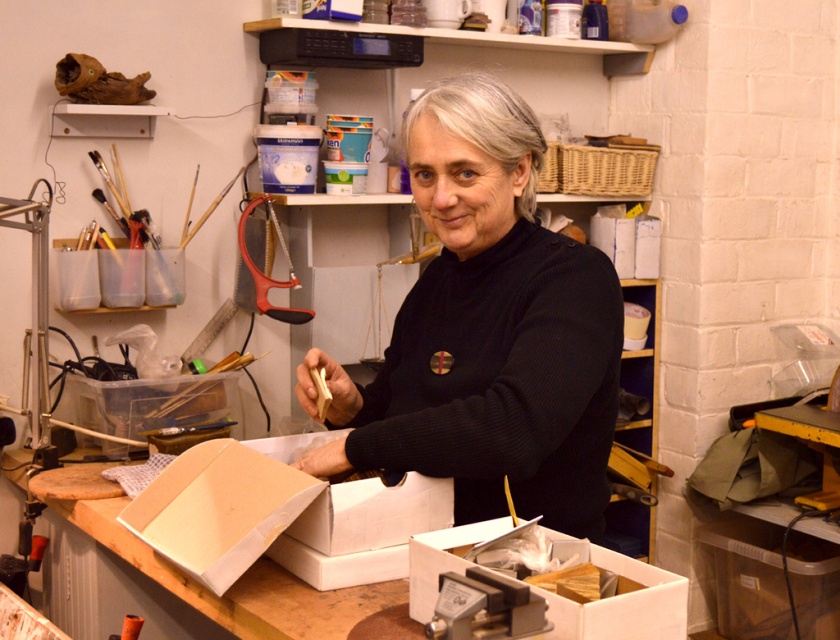
Can you confirm if wooden table at center is positioned to the left of white cardboard box at lower center?

Correct, you'll find wooden table at center to the left of white cardboard box at lower center.

Does wooden table at center have a lesser width compared to white cardboard box at lower center?

No.

This screenshot has width=840, height=640. In order to click on wooden table at center in this screenshot , I will do `click(234, 586)`.

Where is `wooden table at center`? This screenshot has height=640, width=840. wooden table at center is located at coordinates click(234, 586).

Looking at this image, which is below, white cardboard box at center or white cardboard box at lower center?

white cardboard box at lower center

Can you confirm if white cardboard box at center is taller than white cardboard box at lower center?

Indeed, white cardboard box at center has a greater height compared to white cardboard box at lower center.

At what (x,y) coordinates should I click in order to perform the action: click on white cardboard box at center. Please return your answer as a coordinate pair (x, y). Looking at the image, I should click on (282, 516).

Consider the image. Is white cardboard box at center to the left of wooden table at center from the viewer's perspective?

Incorrect, white cardboard box at center is not on the left side of wooden table at center.

From the picture: Does white cardboard box at center appear under wooden table at center?

No.

Find the location of a particular element. The width and height of the screenshot is (840, 640). white cardboard box at center is located at coordinates (282, 516).

The height and width of the screenshot is (640, 840). I want to click on white cardboard box at center, so click(x=282, y=516).